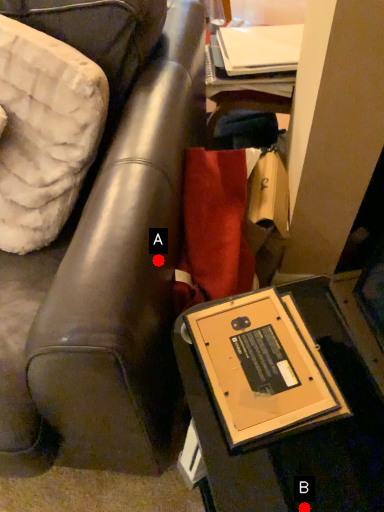
Question: Two points are circled on the image, labeled by A and B beside each circle. Which of the following is the farthest from the observer?

Choices:
 (A) A is further
 (B) B is further

Answer: (A)